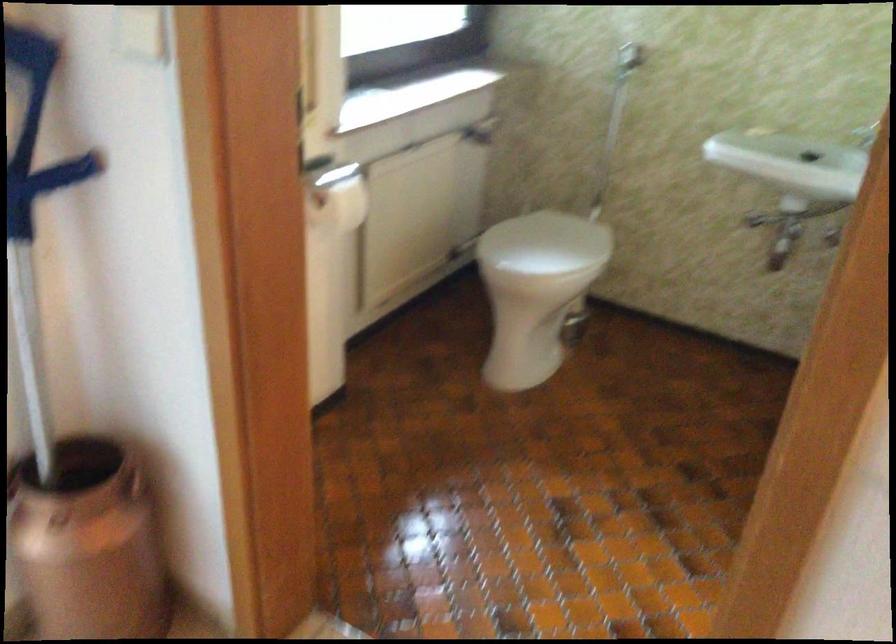
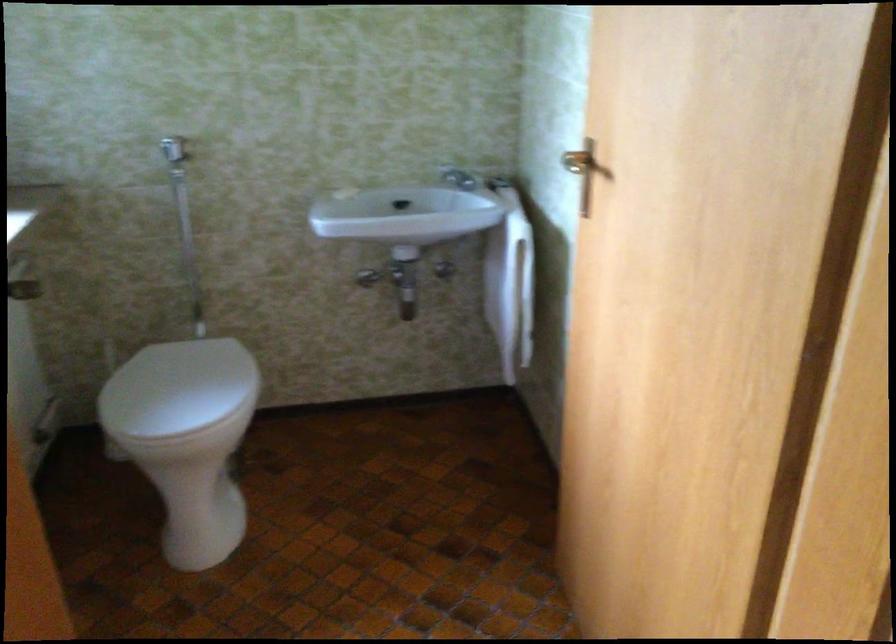
Locate, in the second image, the point that corresponds to [536,243] in the first image.

(177, 388)